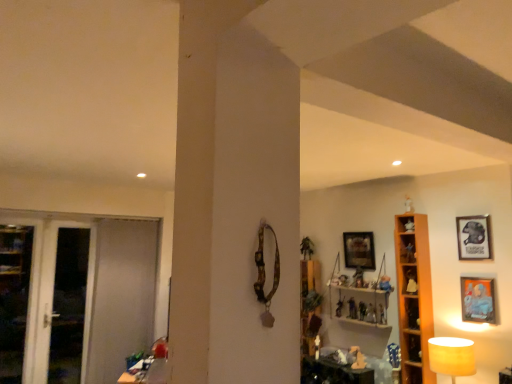
What is the approximate height of metallic silver picture frame at upper right, acting as the 2th picture frame starting from the front?

metallic silver picture frame at upper right, acting as the 2th picture frame starting from the front, is 14.73 inches in height.

Describe the element at coordinates (452, 356) in the screenshot. The height and width of the screenshot is (384, 512). I see `matte yellow lampshade at lower right` at that location.

Find the location of a particular element. This screenshot has height=384, width=512. wooden shelf at right, the 1th shelf viewed from the right is located at coordinates (414, 298).

Identify the location of matte wooden picture frame at right, the third picture frame in the back-to-front sequence. (478, 300).

I want to click on white fabric screen door at left, which is the 1th screen door from right to left, so click(121, 296).

Which is behind, point (379, 310) or point (20, 229)?

The point (20, 229) is behind.

From the image's perspective, is matte plastic toy at center, arranged as the fifth toy when ordered from the bottom, located beneath wooden cabinet at left, which ranks as the first cabinet in back-to-front order?

Correct, matte plastic toy at center, arranged as the fifth toy when ordered from the bottom, appears lower than wooden cabinet at left, which ranks as the first cabinet in back-to-front order, in the image.

Between matte plastic toy at center, positioned as the 5th toy in left-to-right order, and wooden cabinet at left, which appears as the second cabinet when viewed from the right, which one has larger width?

matte plastic toy at center, positioned as the 5th toy in left-to-right order.

Is matte plastic toy at center, which ranks as the 5th toy in back-to-front order, looking in the opposite direction of wooden cabinet at left, which appears as the second cabinet when viewed from the right?

No, wooden cabinet at left, which appears as the second cabinet when viewed from the right, is not at the back of matte plastic toy at center, which ranks as the 5th toy in back-to-front order.

Between white fabric screen door at left, marked as the 2th screen door in a left-to-right arrangement, and wooden picture frame at upper center, acting as the third picture frame starting from the front, which one has smaller size?

Smaller between the two is wooden picture frame at upper center, acting as the third picture frame starting from the front.

Is wooden picture frame at upper center, which is the 1th picture frame from left to right, at the back of white fabric screen door at left, marked as the 2th screen door in a left-to-right arrangement?

No.

From a real-world perspective, is white fabric screen door at left, which is the 1th screen door from right to left, above or below wooden picture frame at upper center, which appears as the third picture frame when viewed from the right?

white fabric screen door at left, which is the 1th screen door from right to left, is below wooden picture frame at upper center, which appears as the third picture frame when viewed from the right.

Can you confirm if wooden table at lower left is shorter than white glossy screen door at left, the 1th screen door viewed from the left?

Correct, wooden table at lower left is not as tall as white glossy screen door at left, the 1th screen door viewed from the left.

From a real-world perspective, does wooden table at lower left stand above white glossy screen door at left, the second screen door in the right-to-left sequence?

No, from a real-world perspective, wooden table at lower left is not over white glossy screen door at left, the second screen door in the right-to-left sequence

Which object is more forward, wooden table at lower left or white glossy screen door at left, the second screen door in the right-to-left sequence?

wooden table at lower left is closer to the camera.

Who is smaller, wooden table at lower left or white glossy screen door at left, the 1th screen door viewed from the left?

wooden table at lower left is smaller.

From the image's perspective, which is below, matte plastic toy at upper right, the sixth toy viewed from the left, or matte wooden picture frame at right, the third picture frame in the back-to-front sequence?

matte wooden picture frame at right, the third picture frame in the back-to-front sequence, appears lower in the image.

From a real-world perspective, is matte plastic toy at upper right, the 6th toy in the bottom-to-top sequence, located beneath matte wooden picture frame at right, positioned as the second picture frame in right-to-left order?

No.

In order to click on the 1st picture frame counting from the right side of the matte plastic toy at upper right, the first toy viewed from the right in this screenshot , I will do `click(478, 300)`.

Considering the sizes of objects matte plastic toy at upper right, the 6th toy in the bottom-to-top sequence, and matte wooden picture frame at right, the first picture frame in the front-to-back sequence, in the image provided, who is shorter, matte plastic toy at upper right, the 6th toy in the bottom-to-top sequence, or matte wooden picture frame at right, the first picture frame in the front-to-back sequence,?

matte plastic toy at upper right, the 6th toy in the bottom-to-top sequence.

Based on their sizes in the image, would you say wooden shelves at right, the first shelf from the back, is bigger or smaller than metallic silver picture frame at upper right, acting as the 2th picture frame starting from the front?

Clearly, wooden shelves at right, the first shelf from the back, is larger in size than metallic silver picture frame at upper right, acting as the 2th picture frame starting from the front.

Which point is more forward, (349,298) or (479,230)?

The point (479,230) is closer to the camera.

Considering the sizes of objects wooden shelves at right, the first shelf from the back, and metallic silver picture frame at upper right, acting as the 2th picture frame starting from the front, in the image provided, who is taller, wooden shelves at right, the first shelf from the back, or metallic silver picture frame at upper right, acting as the 2th picture frame starting from the front,?

Standing taller between the two is wooden shelves at right, the first shelf from the back.

From the image's perspective, which one is positioned lower, wooden shelves at right, which is the 2th shelf from right to left, or metallic silver picture frame at upper right, which is the first picture frame from right to left?

wooden shelves at right, which is the 2th shelf from right to left, is shown below in the image.

Is point (485, 216) less distant than point (372, 304)?

Yes, point (485, 216) is closer to viewer.

From a real-world perspective, between metallic silver picture frame at upper right, acting as the 2th picture frame starting from the front, and translucent plastic figurine at center-right, the fourth toy in the back-to-front sequence, who is vertically higher?

metallic silver picture frame at upper right, acting as the 2th picture frame starting from the front.

Is metallic silver picture frame at upper right, the second picture frame in the back-to-front sequence, spatially inside translucent plastic figurine at center-right, the third toy from the right, or outside of it?

metallic silver picture frame at upper right, the second picture frame in the back-to-front sequence, lies outside translucent plastic figurine at center-right, the third toy from the right.

From the image's perspective, which is above, wooden figurine at center, the 6th toy in the top-to-bottom sequence, or translucent plastic figurine at center-right, which ranks as the 4th toy in bottom-to-top order?

translucent plastic figurine at center-right, which ranks as the 4th toy in bottom-to-top order, is shown above in the image.

Is wooden figurine at center, the 1th toy positioned from the left, closer to camera compared to translucent plastic figurine at center-right, the third toy from the right?

No, wooden figurine at center, the 1th toy positioned from the left, is behind translucent plastic figurine at center-right, the third toy from the right.

Locate an element on the screen. The height and width of the screenshot is (384, 512). toy that is the 3rd object to the left of the translucent plastic figurine at center-right, acting as the 4th toy starting from the left, starting at the anchor is located at coordinates (339, 308).

From a real-world perspective, is wooden figurine at center, arranged as the 1th toy when viewed from the back, beneath translucent plastic figurine at center-right, the third toy from the right?

Yes, from a real-world perspective, wooden figurine at center, arranged as the 1th toy when viewed from the back, is under translucent plastic figurine at center-right, the third toy from the right.

There is a matte plastic toy at center, which ranks as the 2th toy in right-to-left order. Where is `the 1st cabinet above it (from the image's perspective)`? The image size is (512, 384). the 1st cabinet above it (from the image's perspective) is located at coordinates (14, 298).

Starting from the wooden picture frame at upper center, acting as the third picture frame starting from the front, which screen door is the 1st one to the left? Please provide its 2D coordinates.

[(121, 296)]

From the image, which object appears to be nearer to wooden table at lower left, matte plastic toy at center, arranged as the fourth toy when viewed from the right, or wooden figurine at center, the 6th toy in the top-to-bottom sequence?

matte plastic toy at center, arranged as the fourth toy when viewed from the right, lies closer to wooden table at lower left than the other object.

Considering their positions, is wooden table at lower left positioned closer to matte yellow lampshade at lower right than wooden cabinet at right, arranged as the second cabinet when viewed from the left?

Among the two, wooden cabinet at right, arranged as the second cabinet when viewed from the left, is located nearer to matte yellow lampshade at lower right.

Looking at the image, which one is located closer to white glossy screen door at left, the 1th screen door viewed from the left, translucent plastic figurine at center-right, acting as the 4th toy starting from the left, or wooden cabinet at right, which ranks as the 1th cabinet in top-to-bottom order?

translucent plastic figurine at center-right, acting as the 4th toy starting from the left.

Based on their spatial positions, is metallic silver toy at center, which is the second toy in bottom-to-top order, or wooden cabinet at right, acting as the first cabinet starting from the front, closer to matte wooden picture frame at right, positioned as the second picture frame in right-to-left order?

wooden cabinet at right, acting as the first cabinet starting from the front, is positioned closer to the anchor matte wooden picture frame at right, positioned as the second picture frame in right-to-left order.

Which object lies nearer to the anchor point matte yellow lampshade at lower right, matte plastic toy at upper right, arranged as the first toy when viewed from the front, or wooden picture frame at upper center, which appears as the third picture frame when viewed from the right?

Among the two, matte plastic toy at upper right, arranged as the first toy when viewed from the front, is located nearer to matte yellow lampshade at lower right.

When comparing their distances from matte yellow lampshade at lower right, does wooden table at lower left or white fabric screen door at left, marked as the 2th screen door in a left-to-right arrangement, seem closer?

wooden table at lower left is closer to matte yellow lampshade at lower right.

Estimate the real-world distances between objects in this image. Which object is closer to matte plastic toy at upper right, arranged as the 1th toy when viewed from the top, matte plastic toy at center, which ranks as the 5th toy in back-to-front order, or matte yellow lampshade at lower right?

matte plastic toy at center, which ranks as the 5th toy in back-to-front order, lies closer to matte plastic toy at upper right, arranged as the 1th toy when viewed from the top, than the other object.

When comparing their distances from matte plastic toy at center, the 3th toy when ordered from left to right, does wooden shelves at right, the 2th shelf in the front-to-back sequence, or white fabric screen door at left, which is the 1th screen door from right to left, seem closer?

wooden shelves at right, the 2th shelf in the front-to-back sequence, is closer to matte plastic toy at center, the 3th toy when ordered from left to right.

Where is `table between white fabric screen door at left, which is the 1th screen door from right to left, and matte yellow lampshade at lower right`? table between white fabric screen door at left, which is the 1th screen door from right to left, and matte yellow lampshade at lower right is located at coordinates (147, 372).

Identify the location of cabinet situated between white glossy screen door at left, the 1th screen door viewed from the left, and matte yellow lampshade at lower right from left to right. (409, 280).

Where is `table located between white fabric screen door at left, which is the 1th screen door from right to left, and wooden figurine at center, arranged as the 1th toy when viewed from the back, in the left-right direction`? Image resolution: width=512 pixels, height=384 pixels. table located between white fabric screen door at left, which is the 1th screen door from right to left, and wooden figurine at center, arranged as the 1th toy when viewed from the back, in the left-right direction is located at coordinates (147, 372).

Identify the location of screen door between white glossy screen door at left, the 1th screen door viewed from the left, and wooden cabinet at right, acting as the first cabinet starting from the right, from left to right. (121, 296).